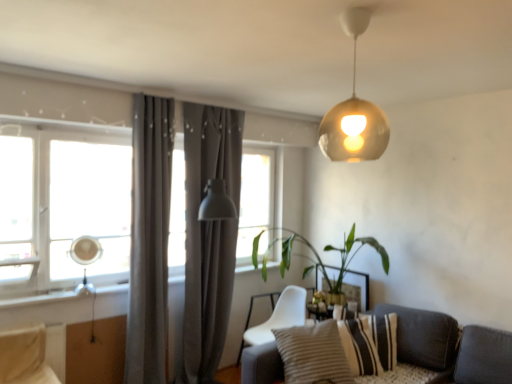
Question: Can you confirm if matte gray curtain at center, which is the first curtain in back-to-front order, is bigger than gold metallic sphere at upper center?

Choices:
 (A) no
 (B) yes

Answer: (B)

Question: Considering the relative sizes of matte gray curtain at center, which is the first curtain in back-to-front order, and gold metallic sphere at upper center in the image provided, is matte gray curtain at center, which is the first curtain in back-to-front order, wider than gold metallic sphere at upper center?

Choices:
 (A) no
 (B) yes

Answer: (A)

Question: Is matte gray curtain at center, which is the first curtain in back-to-front order, to the right of gold metallic sphere at upper center from the viewer's perspective?

Choices:
 (A) yes
 (B) no

Answer: (B)

Question: Does matte gray curtain at center, which is the first curtain in back-to-front order, appear on the left side of gold metallic sphere at upper center?

Choices:
 (A) no
 (B) yes

Answer: (B)

Question: From the image's perspective, does matte gray curtain at center, which is the first curtain in back-to-front order, appear lower than gold metallic sphere at upper center?

Choices:
 (A) no
 (B) yes

Answer: (B)

Question: From the image's perspective, is striped fabric pillow at lower right, the second pillow positioned from the back, located above or below gray fabric curtain at left, the second curtain positioned from the back?

Choices:
 (A) below
 (B) above

Answer: (A)

Question: From a real-world perspective, relative to gray fabric curtain at left, which ranks as the 1th curtain in front-to-back order, is striped fabric pillow at lower right, the second pillow positioned from the back, vertically above or below?

Choices:
 (A) above
 (B) below

Answer: (B)

Question: Considering the relative positions of striped fabric pillow at lower right, the second pillow positioned from the back, and gray fabric curtain at left, the second curtain positioned from the back, in the image provided, is striped fabric pillow at lower right, the second pillow positioned from the back, to the left or to the right of gray fabric curtain at left, the second curtain positioned from the back,?

Choices:
 (A) right
 (B) left

Answer: (A)

Question: Does point (342, 380) appear closer or farther from the camera than point (148, 205)?

Choices:
 (A) farther
 (B) closer

Answer: (B)

Question: From a real-world perspective, is white fabric chair at lower center above or below matte gray curtain at center, which is the first curtain in back-to-front order?

Choices:
 (A) above
 (B) below

Answer: (B)

Question: Is point (239, 360) closer or farther from the camera than point (204, 148)?

Choices:
 (A) closer
 (B) farther

Answer: (B)

Question: Looking at the image, does white fabric chair at lower center seem bigger or smaller compared to matte gray curtain at center, which is the first curtain in back-to-front order?

Choices:
 (A) small
 (B) big

Answer: (A)

Question: From the image's perspective, relative to matte gray curtain at center, which is counted as the 2th curtain, starting from the front, is white fabric chair at lower center above or below?

Choices:
 (A) above
 (B) below

Answer: (B)

Question: Based on their positions, is matte gray curtain at center, which is the first curtain in back-to-front order, located to the left or right of white fabric chair at lower center?

Choices:
 (A) right
 (B) left

Answer: (B)

Question: From the image's perspective, is matte gray curtain at center, which is the first curtain in back-to-front order, positioned above or below white fabric chair at lower center?

Choices:
 (A) above
 (B) below

Answer: (A)